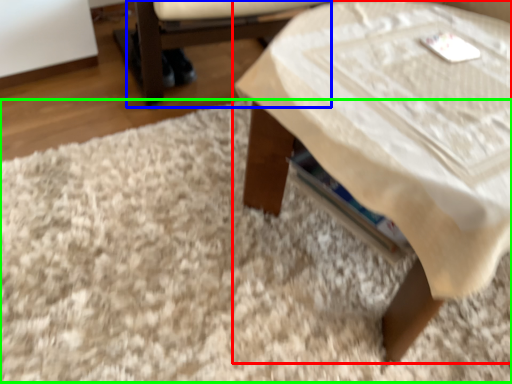
Question: Estimate the real-world distances between objects in this image. Which object is farther from table (highlighted by a red box), armchair (highlighted by a blue box) or mat (highlighted by a green box)?

Choices:
 (A) armchair
 (B) mat

Answer: (A)